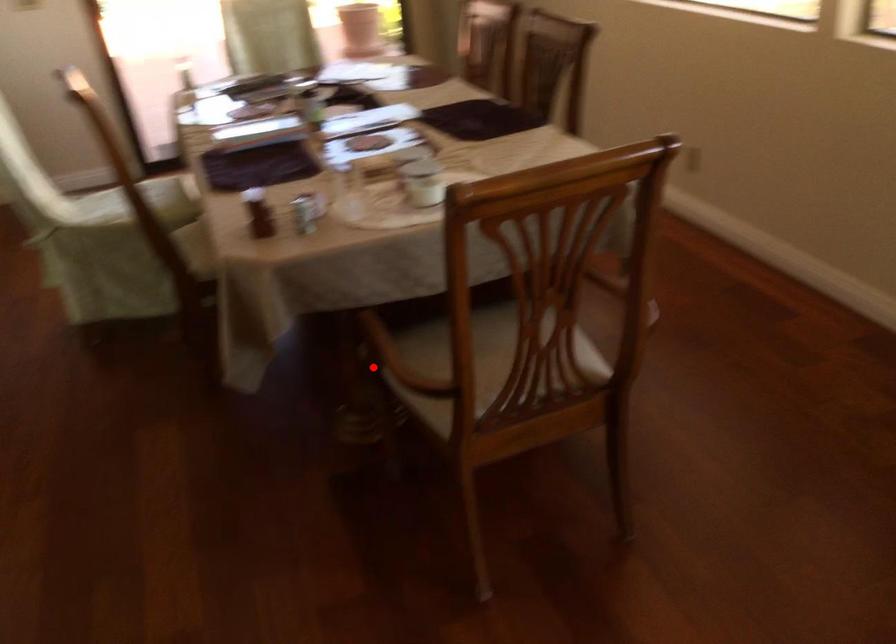
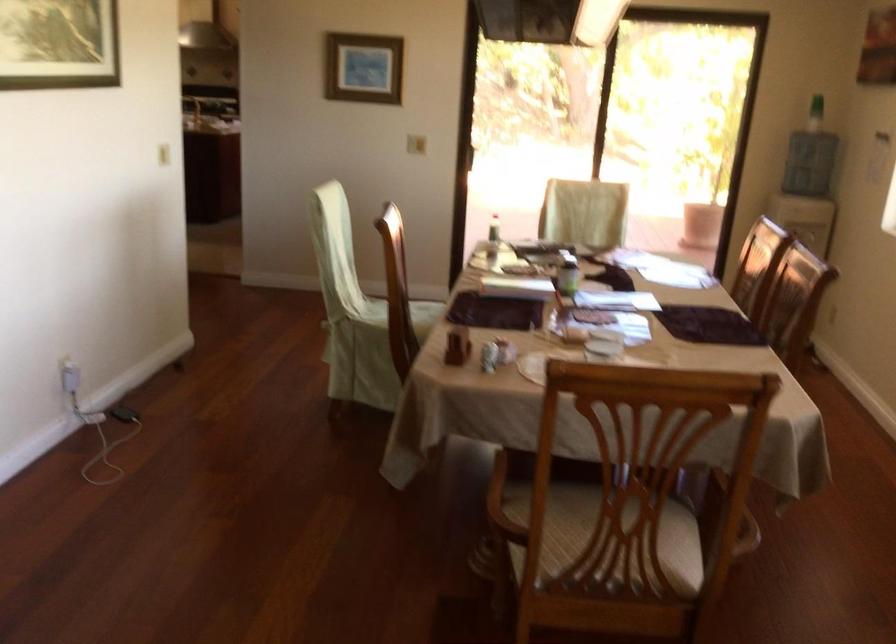
Question: A red point is marked in image1. In image2, is the corresponding 3D point closer to the camera or farther? Reply with the corresponding letter.

Choices:
 (A) The corresponding 3D point is closer.
 (B) The corresponding 3D point is farther.

Answer: (B)